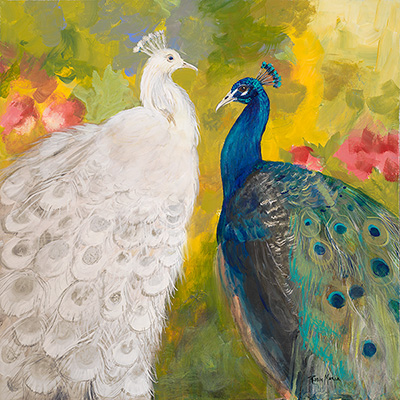
This screenshot has height=400, width=400. In order to click on yellow paint in this screenshot , I will do 310,97, 197,241, 271,139, 309,51, 68,85, 24,89.